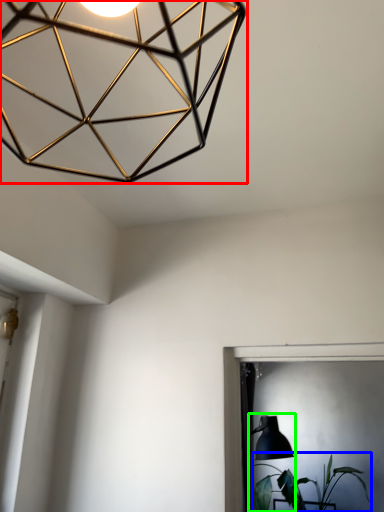
Question: Based on their relative distances, which object is nearer to lamp (highlighted by a red box)? Choose from houseplant (highlighted by a blue box) and table lamp (highlighted by a green box).

Choices:
 (A) houseplant
 (B) table lamp

Answer: (B)